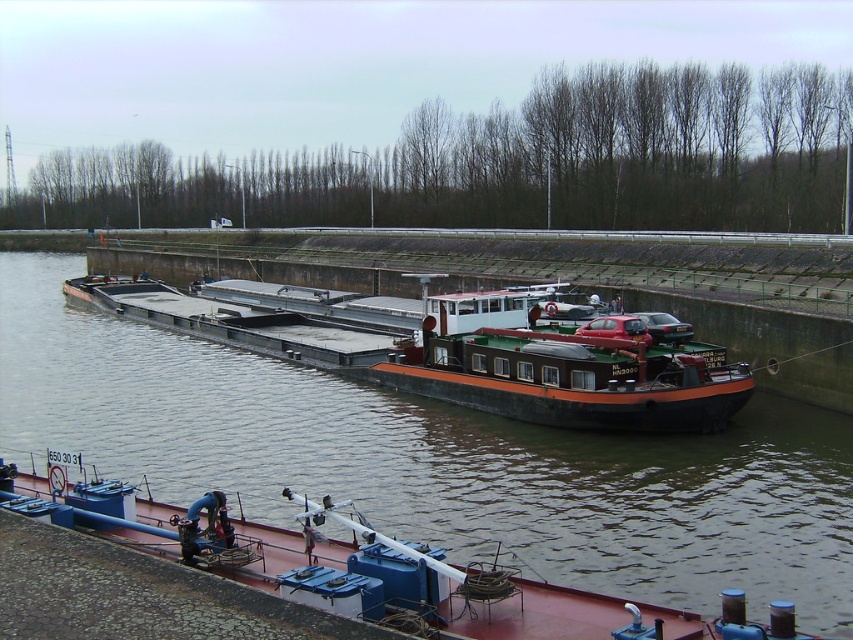
Can you confirm if brown matte barge at center is positioned to the left of reddish-brown metal barge at lower center?

Indeed, brown matte barge at center is positioned on the left side of reddish-brown metal barge at lower center.

Between brown matte barge at center and reddish-brown metal barge at lower center, which one appears on the left side from the viewer's perspective?

Positioned to the left is brown matte barge at center.

Does point (57, 316) come closer to viewer compared to point (787, 611)?

No.

At what (x,y) coordinates should I click in order to perform the action: click on brown matte barge at center. Please return your answer as a coordinate pair (x, y). Image resolution: width=853 pixels, height=640 pixels. Looking at the image, I should click on (438, 460).